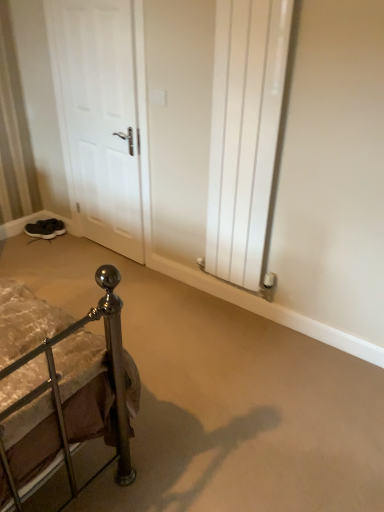
Where is `vacant space to the left of white matte door at left`? Image resolution: width=384 pixels, height=512 pixels. vacant space to the left of white matte door at left is located at coordinates (60, 252).